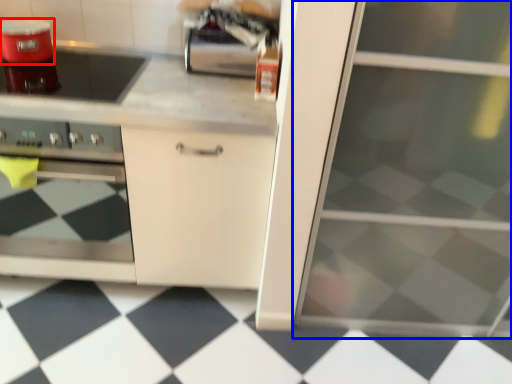
Question: Which point is further to the camera, kitchen appliance (highlighted by a red box) or screen door (highlighted by a blue box)?

Choices:
 (A) kitchen appliance
 (B) screen door

Answer: (A)